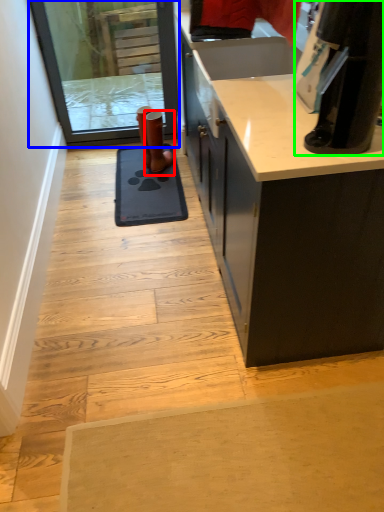
Question: Considering the real-world distances, which object is closest to footwear (highlighted by a red box)? screen door (highlighted by a blue box) or appliance (highlighted by a green box).

Choices:
 (A) screen door
 (B) appliance

Answer: (A)